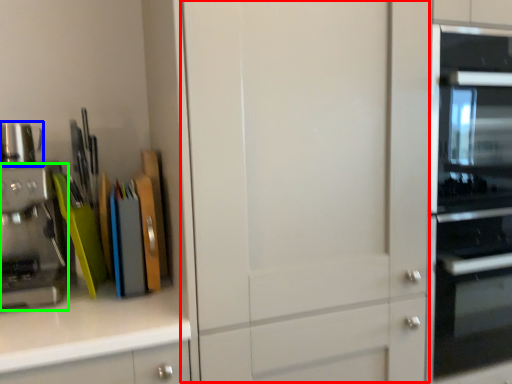
Question: Which object is the closest to the glass door (highlighted by a red box)? Choose among these: appliance (highlighted by a blue box) or kitchen appliance (highlighted by a green box).

Choices:
 (A) appliance
 (B) kitchen appliance

Answer: (B)